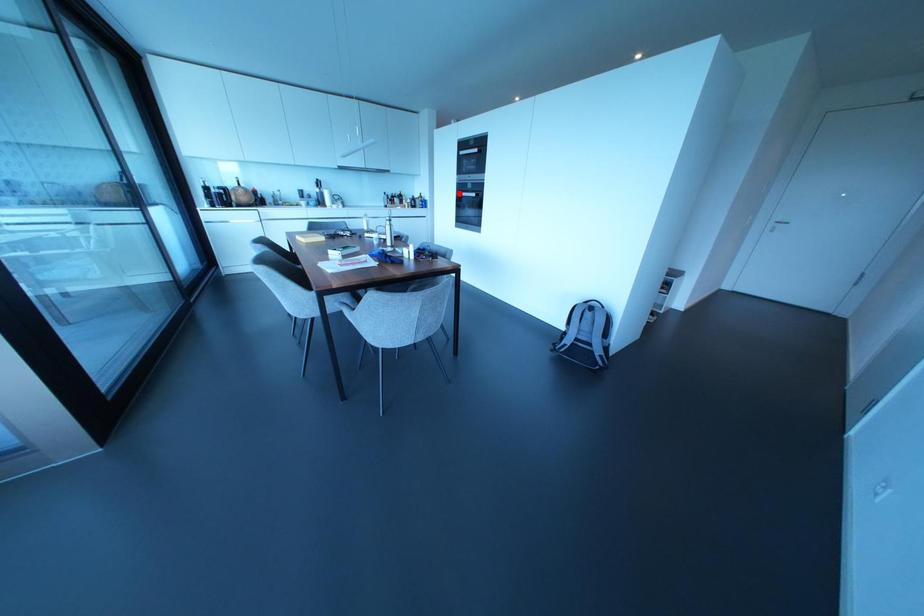
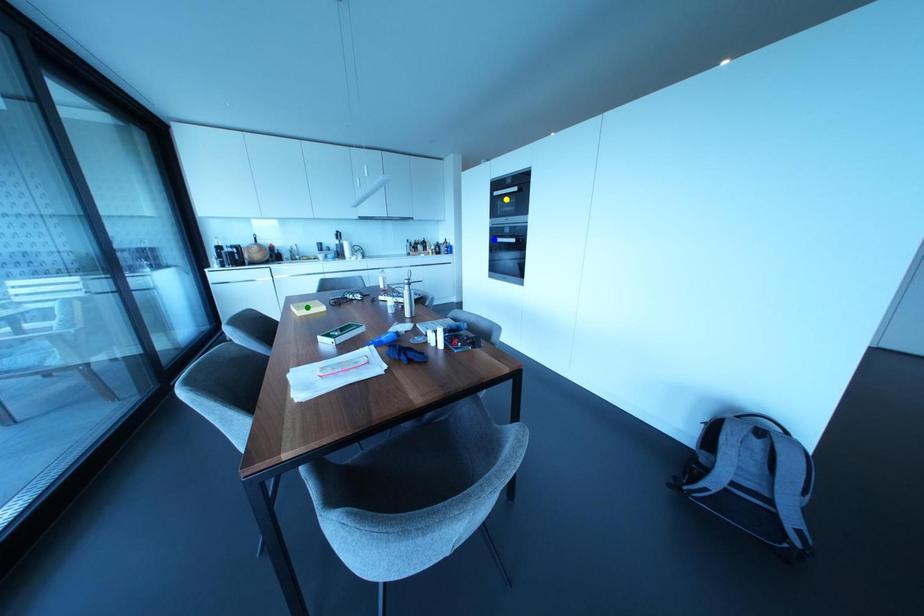
Question: I am providing you with two images of the same scene from different viewpoints. A red point is marked on the first image. You are given multiple points on the second image. Which point in image 2 represents the same 3d spot as the red point in image 1?

Choices:
 (A) blue point
 (B) green point
 (C) yellow point

Answer: (A)